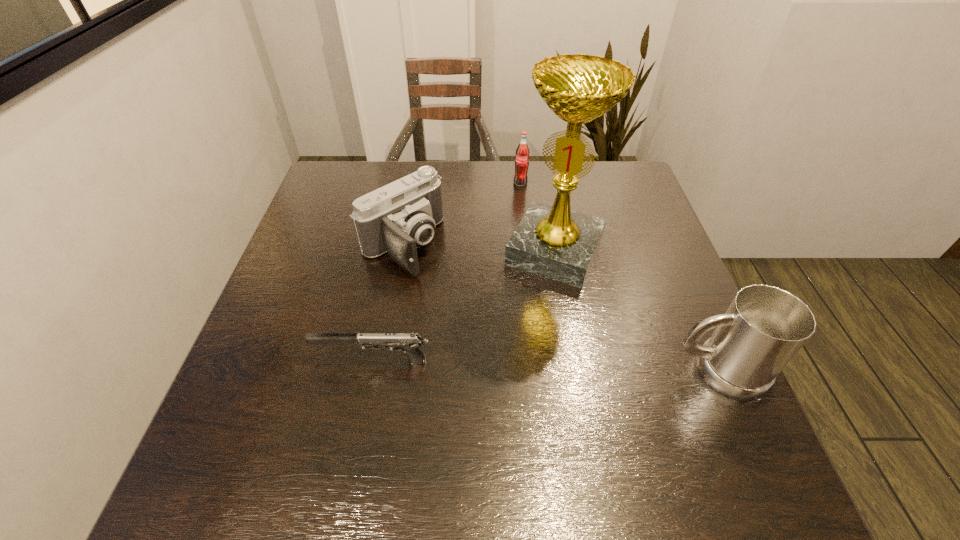
The width and height of the screenshot is (960, 540). Find the location of `free spot located 0.280m on the label of the soda bottle`. free spot located 0.280m on the label of the soda bottle is located at coordinates (515, 249).

You are a GUI agent. You are given a task and a screenshot of the screen. Output one action in this format:
    pyautogui.click(x=<x>, y=<y>)
    Task: Click on the free space located 0.220m on the label of the soda bottle
    This screenshot has height=540, width=960.
    Given the screenshot: What is the action you would take?
    pyautogui.click(x=516, y=234)

The height and width of the screenshot is (540, 960). Find the location of `vacant space located 0.200m at the front of the camera with an open lens cover`. vacant space located 0.200m at the front of the camera with an open lens cover is located at coordinates [x=481, y=319].

You are a GUI agent. You are given a task and a screenshot of the screen. Output one action in this format:
    pyautogui.click(x=<x>, y=<y>)
    Task: Click on the free location located 0.120m at the front of the camera with an open lens cover
    Image resolution: width=960 pixels, height=540 pixels.
    Given the screenshot: What is the action you would take?
    pyautogui.click(x=458, y=299)

The image size is (960, 540). In order to click on vacant space located at the front of the camera with an open lens cover in this screenshot , I will do `click(442, 285)`.

Locate an element on the screen. The height and width of the screenshot is (540, 960). vacant space located on the front-facing side of the award is located at coordinates (472, 421).

The image size is (960, 540). Find the location of `blank space located 0.160m on the front-facing side of the award`. blank space located 0.160m on the front-facing side of the award is located at coordinates (514, 335).

You are a GUI agent. You are given a task and a screenshot of the screen. Output one action in this format:
    pyautogui.click(x=<x>, y=<y>)
    Task: Click on the vacant space located 0.230m on the front-facing side of the award
    Image resolution: width=960 pixels, height=540 pixels.
    Given the screenshot: What is the action you would take?
    pyautogui.click(x=501, y=361)

At what (x,y) coordinates should I click in order to perform the action: click on object that is at the far edge. Please return your answer as a coordinate pair (x, y). Looking at the image, I should click on (522, 152).

Locate an element on the screen. The width and height of the screenshot is (960, 540). object that is at the near edge is located at coordinates coord(764,327).